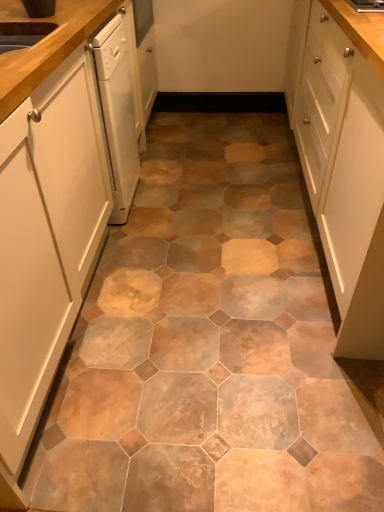
Identify the location of white matte cabinet at left, the 2th cabinetry positioned from the right. Image resolution: width=384 pixels, height=512 pixels. (46, 208).

Describe the element at coordinates (46, 208) in the screenshot. I see `white matte cabinet at left, the 2th cabinetry positioned from the right` at that location.

Identify the location of white matte cabinet at right, positioned as the 2th cabinetry in left-to-right order. The height and width of the screenshot is (512, 384). (343, 158).

What do you see at coordinates (343, 158) in the screenshot? I see `white matte cabinet at right, positioned as the first cabinetry in right-to-left order` at bounding box center [343, 158].

Measure the distance between white matte cabinet at right, positioned as the 2th cabinetry in left-to-right order, and camera.

white matte cabinet at right, positioned as the 2th cabinetry in left-to-right order, and camera are 1.11 meters apart from each other.

This screenshot has height=512, width=384. I want to click on white matte cabinet at left, the 2th cabinetry positioned from the right, so click(46, 208).

Is white matte cabinet at right, positioned as the first cabinetry in right-to-left order, at the left side of white matte cabinet at left, arranged as the first cabinetry when viewed from the left?

No, white matte cabinet at right, positioned as the first cabinetry in right-to-left order, is not to the left of white matte cabinet at left, arranged as the first cabinetry when viewed from the left.

Is white matte cabinet at right, positioned as the 2th cabinetry in left-to-right order, further to the viewer compared to white matte cabinet at left, arranged as the first cabinetry when viewed from the left?

Yes, it is.

Is point (352, 322) more distant than point (90, 17)?

That is False.

From the image's perspective, who appears lower, white matte cabinet at right, positioned as the 2th cabinetry in left-to-right order, or white matte cabinet at left, arranged as the first cabinetry when viewed from the left?

white matte cabinet at left, arranged as the first cabinetry when viewed from the left, from the image's perspective.

From a real-world perspective, is white matte cabinet at right, positioned as the first cabinetry in right-to-left order, physically below white matte cabinet at left, the 2th cabinetry positioned from the right?

No, from a real-world perspective, white matte cabinet at right, positioned as the first cabinetry in right-to-left order, is not beneath white matte cabinet at left, the 2th cabinetry positioned from the right.

Can you confirm if white matte cabinet at right, positioned as the first cabinetry in right-to-left order, is wider than white matte cabinet at left, arranged as the first cabinetry when viewed from the left?

Yes.

From their relative heights in the image, would you say white matte cabinet at right, positioned as the 2th cabinetry in left-to-right order, is taller or shorter than white matte cabinet at left, the 2th cabinetry positioned from the right?

Clearly, white matte cabinet at right, positioned as the 2th cabinetry in left-to-right order, is shorter compared to white matte cabinet at left, the 2th cabinetry positioned from the right.

Looking at the image, does white matte cabinet at right, positioned as the first cabinetry in right-to-left order, seem bigger or smaller compared to white matte cabinet at left, the 2th cabinetry positioned from the right?

Considering their sizes, white matte cabinet at right, positioned as the first cabinetry in right-to-left order, takes up more space than white matte cabinet at left, the 2th cabinetry positioned from the right.

Is white matte cabinet at right, positioned as the first cabinetry in right-to-left order, outside of white matte cabinet at left, the 2th cabinetry positioned from the right?

white matte cabinet at right, positioned as the first cabinetry in right-to-left order, is positioned outside white matte cabinet at left, the 2th cabinetry positioned from the right.

Is white matte cabinet at right, positioned as the first cabinetry in right-to-left order, far from white matte cabinet at left, the 2th cabinetry positioned from the right?

That's not correct — white matte cabinet at right, positioned as the first cabinetry in right-to-left order, is a little close to white matte cabinet at left, the 2th cabinetry positioned from the right.

Is white matte cabinet at right, positioned as the first cabinetry in right-to-left order, positioned with its back to white matte cabinet at left, arranged as the first cabinetry when viewed from the left?

No, white matte cabinet at right, positioned as the first cabinetry in right-to-left order, is not facing away from white matte cabinet at left, arranged as the first cabinetry when viewed from the left.

How much distance is there between white matte cabinet at right, positioned as the first cabinetry in right-to-left order, and white matte cabinet at left, arranged as the first cabinetry when viewed from the left?

A distance of 36.22 inches exists between white matte cabinet at right, positioned as the first cabinetry in right-to-left order, and white matte cabinet at left, arranged as the first cabinetry when viewed from the left.

The height and width of the screenshot is (512, 384). In order to click on cabinetry on the right side of white matte cabinet at left, arranged as the first cabinetry when viewed from the left in this screenshot , I will do `click(343, 158)`.

Which object is positioned more to the right, white matte cabinet at left, arranged as the first cabinetry when viewed from the left, or white matte cabinet at right, positioned as the first cabinetry in right-to-left order?

From the viewer's perspective, white matte cabinet at right, positioned as the first cabinetry in right-to-left order, appears more on the right side.

Between white matte cabinet at left, the 2th cabinetry positioned from the right, and white matte cabinet at right, positioned as the 2th cabinetry in left-to-right order, which one is positioned behind?

white matte cabinet at right, positioned as the 2th cabinetry in left-to-right order, is further away from the camera.

Is point (25, 105) closer or farther from the camera than point (307, 56)?

Point (25, 105) appears to be closer to the viewer than point (307, 56).

From the picture: From the image's perspective, is white matte cabinet at left, arranged as the first cabinetry when viewed from the left, above white matte cabinet at right, positioned as the first cabinetry in right-to-left order?

No, from the image's perspective, white matte cabinet at left, arranged as the first cabinetry when viewed from the left, is not on top of white matte cabinet at right, positioned as the first cabinetry in right-to-left order.

From a real-world perspective, which object stands above the other?

In real-world perspective, white matte cabinet at right, positioned as the first cabinetry in right-to-left order, is above.

Which of these two, white matte cabinet at left, the 2th cabinetry positioned from the right, or white matte cabinet at right, positioned as the 2th cabinetry in left-to-right order, is thinner?

white matte cabinet at left, the 2th cabinetry positioned from the right, is thinner.

Which of these two, white matte cabinet at left, arranged as the first cabinetry when viewed from the left, or white matte cabinet at right, positioned as the first cabinetry in right-to-left order, stands shorter?

white matte cabinet at right, positioned as the first cabinetry in right-to-left order.

Does white matte cabinet at left, the 2th cabinetry positioned from the right, have a smaller size compared to white matte cabinet at right, positioned as the first cabinetry in right-to-left order?

Correct, white matte cabinet at left, the 2th cabinetry positioned from the right, occupies less space than white matte cabinet at right, positioned as the first cabinetry in right-to-left order.

Would you say white matte cabinet at right, positioned as the first cabinetry in right-to-left order, is part of white matte cabinet at left, the 2th cabinetry positioned from the right,'s contents?

No, white matte cabinet at right, positioned as the first cabinetry in right-to-left order, is not inside white matte cabinet at left, the 2th cabinetry positioned from the right.

Is white matte cabinet at left, the 2th cabinetry positioned from the right, beside white matte cabinet at right, positioned as the 2th cabinetry in left-to-right order?

No, white matte cabinet at left, the 2th cabinetry positioned from the right, is not next to white matte cabinet at right, positioned as the 2th cabinetry in left-to-right order.

Based on the photo, is white matte cabinet at left, the 2th cabinetry positioned from the right, oriented towards white matte cabinet at right, positioned as the 2th cabinetry in left-to-right order?

Yes, white matte cabinet at left, the 2th cabinetry positioned from the right, is aimed at white matte cabinet at right, positioned as the 2th cabinetry in left-to-right order.

I want to click on cabinetry that appears below the white matte cabinet at right, positioned as the first cabinetry in right-to-left order (from a real-world perspective), so click(x=46, y=208).

Find the location of a particular element. cabinetry above the white matte cabinet at left, arranged as the first cabinetry when viewed from the left (from a real-world perspective) is located at coordinates (343, 158).

The height and width of the screenshot is (512, 384). Find the location of `cabinetry located underneath the white matte cabinet at right, positioned as the 2th cabinetry in left-to-right order (from a real-world perspective)`. cabinetry located underneath the white matte cabinet at right, positioned as the 2th cabinetry in left-to-right order (from a real-world perspective) is located at coordinates click(x=46, y=208).